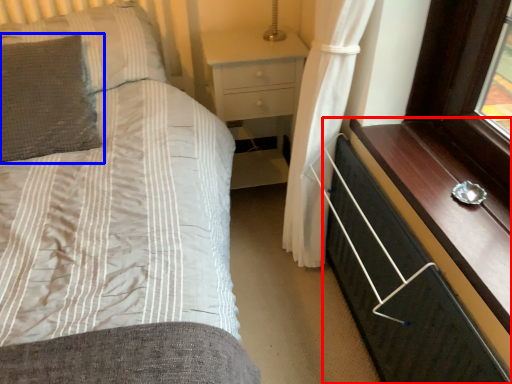
Question: Which of the following is the farthest to the observer, chest of drawers (highlighted by a red box) or pillow (highlighted by a blue box)?

Choices:
 (A) chest of drawers
 (B) pillow

Answer: (B)